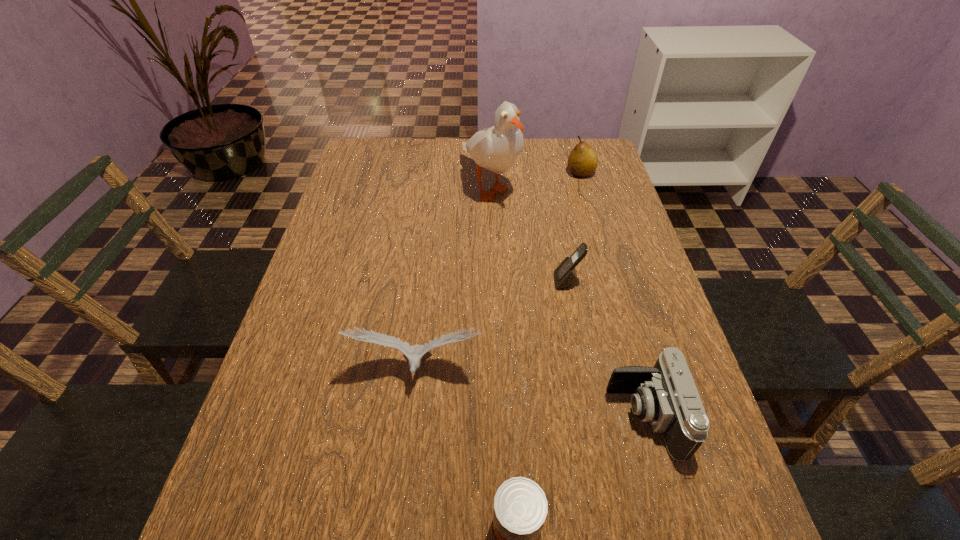
Where is `vacant area that lies between the nearer gull and the camera`? vacant area that lies between the nearer gull and the camera is located at coordinates (531, 393).

At what (x,y) coordinates should I click in order to perform the action: click on empty space that is in between the taller gull and the fourth nearest object. Please return your answer as a coordinate pair (x, y). Image resolution: width=960 pixels, height=540 pixels. Looking at the image, I should click on (529, 234).

Image resolution: width=960 pixels, height=540 pixels. I want to click on vacant space that's between the pear and the shorter gull, so click(499, 272).

Where is `free area in between the farther gull and the cellular telephone`? This screenshot has width=960, height=540. free area in between the farther gull and the cellular telephone is located at coordinates pos(529,234).

Where is `vacant point located between the farther gull and the nearer gull`? The height and width of the screenshot is (540, 960). vacant point located between the farther gull and the nearer gull is located at coordinates (454, 278).

Find the location of a particular element. object that is the fifth closest one to the shorter gull is located at coordinates (582, 162).

The height and width of the screenshot is (540, 960). Identify the location of object that stands as the fifth closest to the camera. (582, 162).

The height and width of the screenshot is (540, 960). Identify the location of blank space that satisfies the following two spatial constraints: 1. on the front-facing side of the fourth object from left to right; 2. at the tip of the beak of the nearer gull. (584, 370).

Identify the location of vacant region that satisfies the following two spatial constraints: 1. on the front-facing side of the cellular telephone; 2. at the tip of the beak of the shorter gull. (584, 370).

The width and height of the screenshot is (960, 540). What are the coordinates of `blank space that satisfies the following two spatial constraints: 1. on the front-facing side of the fourth object from left to right; 2. at the tip of the beak of the shorter gull` in the screenshot? It's located at (584, 370).